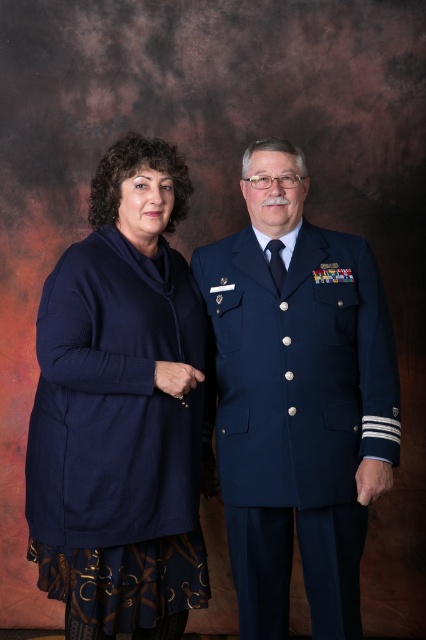
Describe the element at coordinates (120, 410) in the screenshot. I see `navy knit sweater at left` at that location.

Can you confirm if navy knit sweater at left is positioned below navy blue uniform at center?

Indeed, navy knit sweater at left is positioned under navy blue uniform at center.

Which is in front, point (97, 506) or point (230, 308)?

Point (97, 506)

You are a GUI agent. You are given a task and a screenshot of the screen. Output one action in this format:
    pyautogui.click(x=<x>, y=<y>)
    Task: Click on the navy knit sweater at left
    
    Given the screenshot: What is the action you would take?
    pyautogui.click(x=120, y=410)